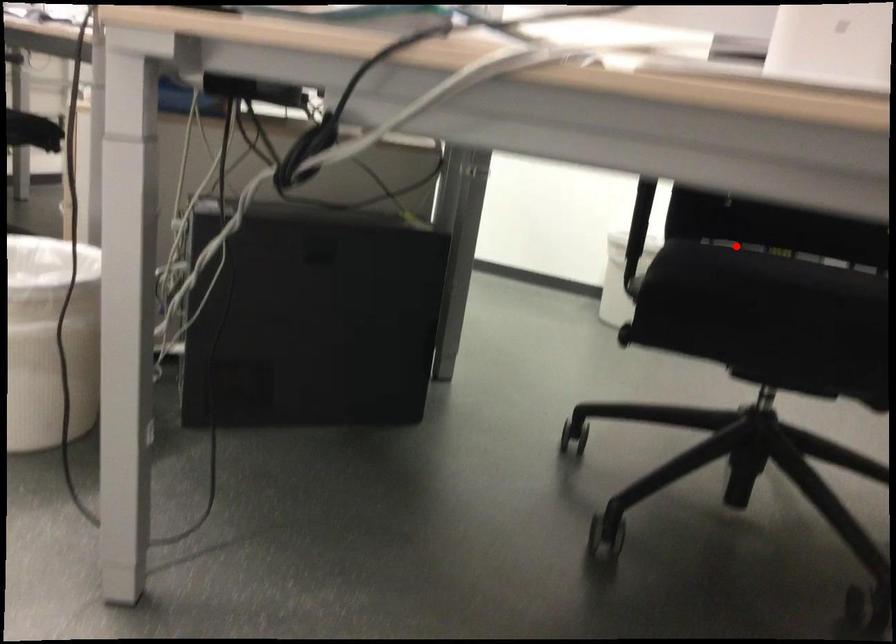
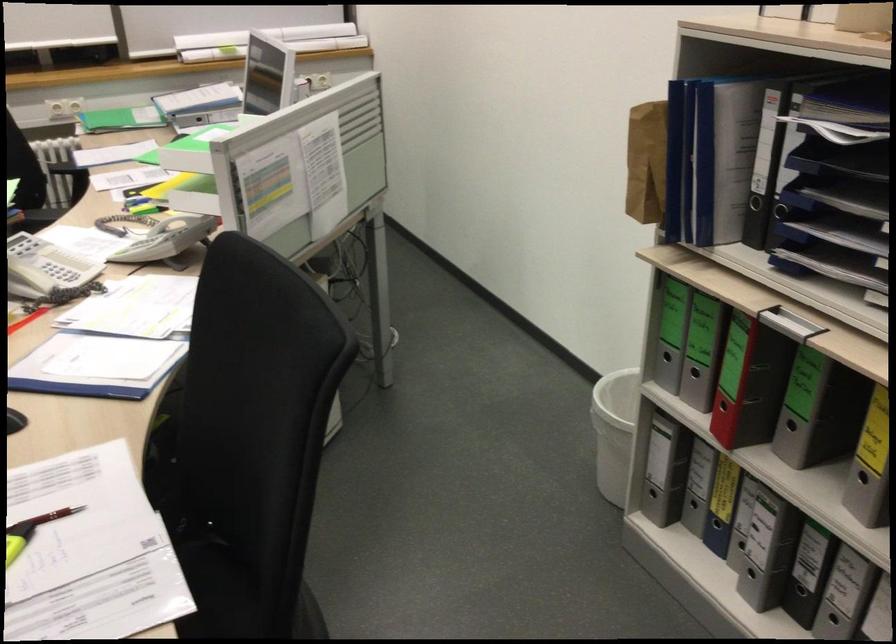
Question: I am providing you with two images of the same scene from different viewpoints. A red point is marked on the first image. At the location where the point appears in image 1, is it still visible in image 2?

Choices:
 (A) Yes
 (B) No

Answer: (A)